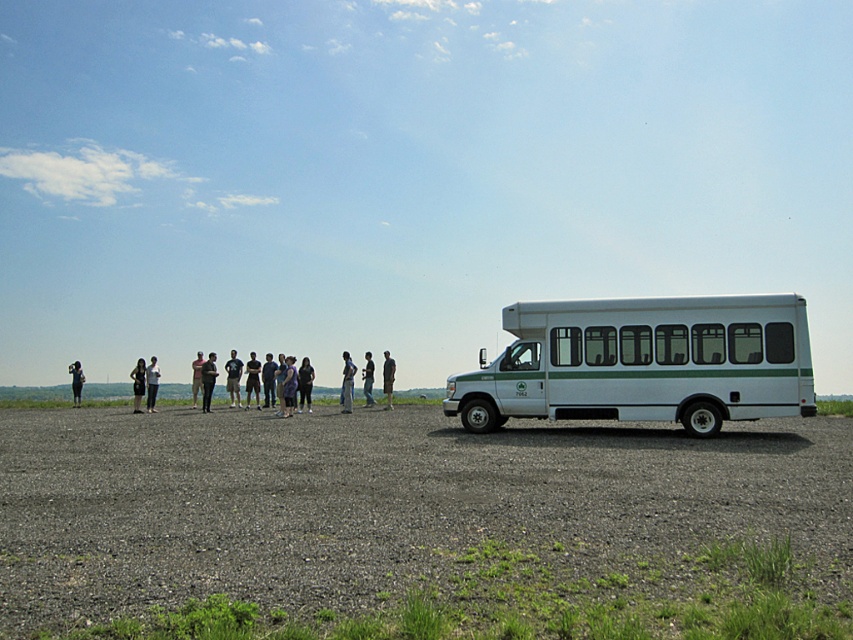
Question: Which object appears farthest from the camera in this image?

Choices:
 (A) dark gray shirt at left
 (B) dark gray fabric jacket at left
 (C) dark gray fabric jacket at center

Answer: (A)

Question: Does dark blue jeans at center appear under light brown fabric shirt at center?

Choices:
 (A) yes
 (B) no

Answer: (B)

Question: From the image, what is the correct spatial relationship of light blue denim shorts at center in relation to light brown fabric shirt at center?

Choices:
 (A) below
 (B) above

Answer: (B)

Question: Estimate the real-world distances between objects in this image. Which object is closer to the dark blue t-shirt at center?

Choices:
 (A) light blue jeans at center
 (B) light blue denim shorts at center
 (C) purple fabric dress at center

Answer: (C)

Question: Which of the following is the farthest from the observer?

Choices:
 (A) (273, 397)
 (B) (751, 529)
 (C) (386, 360)

Answer: (A)

Question: Is light blue denim shorts at center thinner than dark gray fabric jacket at left?

Choices:
 (A) no
 (B) yes

Answer: (B)